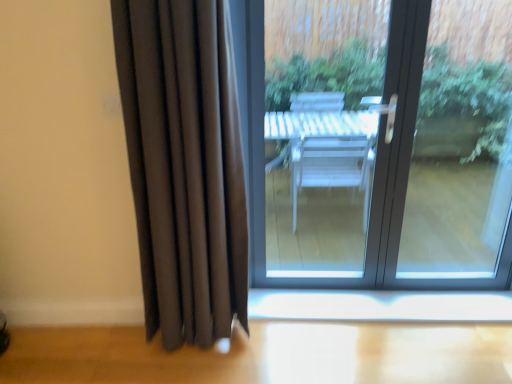
Question: From the image's perspective, relative to matte glass door at center, is white glossy window sill at lower center above or below?

Choices:
 (A) above
 (B) below

Answer: (B)

Question: From a real-world perspective, is white glossy window sill at lower center above or below matte glass door at center?

Choices:
 (A) below
 (B) above

Answer: (A)

Question: Considering the real-world distances, which object is closest to the matte black curtain at left?

Choices:
 (A) matte glass door at center
 (B) white glossy window sill at lower center

Answer: (B)

Question: Which object is the farthest from the matte black curtain at left?

Choices:
 (A) white glossy window sill at lower center
 (B) matte glass door at center

Answer: (B)